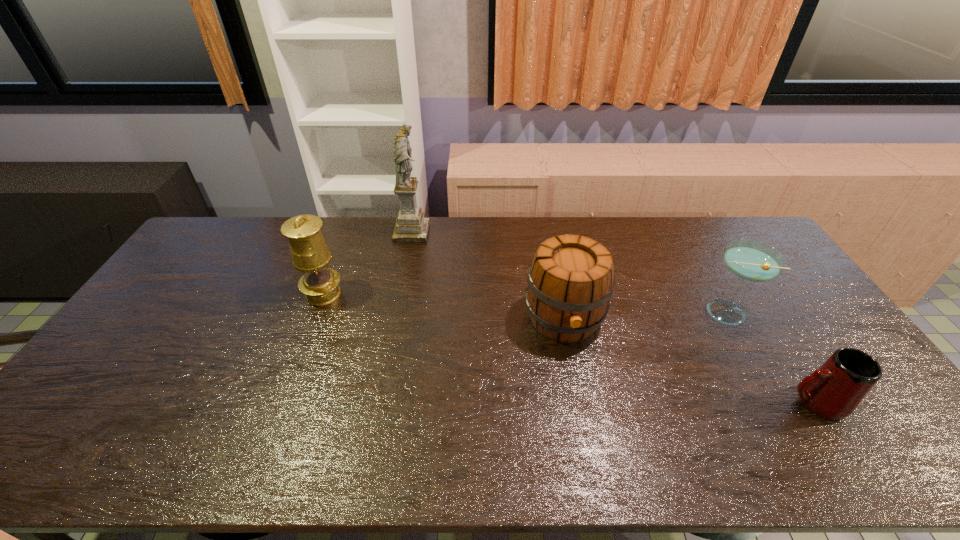
This screenshot has width=960, height=540. I want to click on sculpture, so click(411, 226).

The image size is (960, 540). I want to click on the tallest object, so click(411, 226).

Where is `the leftmost object`? the leftmost object is located at coordinates (310, 254).

Locate an element on the screen. The image size is (960, 540). the second tallest object is located at coordinates (310, 254).

Where is `the third object from left to right`? Image resolution: width=960 pixels, height=540 pixels. the third object from left to right is located at coordinates (570, 282).

At what (x,y) coordinates should I click in order to perform the action: click on martini. Please return your answer as a coordinate pair (x, y). Looking at the image, I should click on (750, 260).

At what (x,y) coordinates should I click in order to perform the action: click on mug. Please return your answer as a coordinate pair (x, y). Looking at the image, I should click on (834, 391).

You are a GUI agent. You are given a task and a screenshot of the screen. Output one action in this format:
    pyautogui.click(x=<x>, y=<y>)
    Task: Click on the nearest object
    
    Given the screenshot: What is the action you would take?
    (x=834, y=391)

At what (x,y) coordinates should I click in order to perform the action: click on free location located 0.080m on the front-facing side of the sculpture. Please return your answer as a coordinate pair (x, y). This screenshot has height=540, width=960. Looking at the image, I should click on (449, 232).

Find the location of `vacant space situated 0.110m on the back of the second tallest object`. vacant space situated 0.110m on the back of the second tallest object is located at coordinates (336, 259).